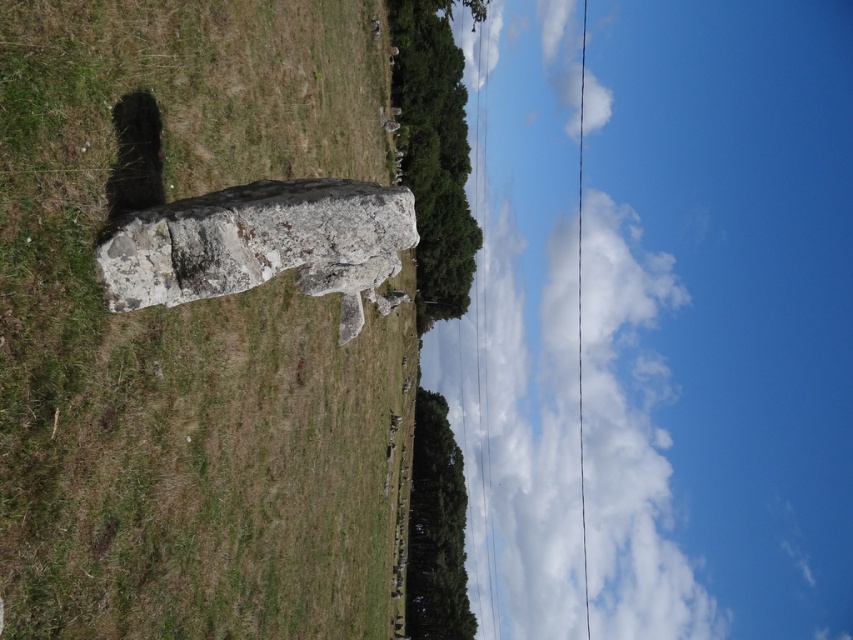
Is white fluffy cloud at upper center thinner than rough stone rock at center?

Incorrect, white fluffy cloud at upper center's width is not less than rough stone rock at center's.

Between point (624, 221) and point (223, 200), which one is positioned behind?

The point (624, 221) is more distant.

At what (x,y) coordinates should I click in order to perform the action: click on white fluffy cloud at upper center. Please return your answer as a coordinate pair (x, y). Looking at the image, I should click on (560, 388).

Does speckled stone monolith at center lie in front of rough stone rock at center?

Yes, speckled stone monolith at center is closer to the viewer.

Is point (302, 83) farther from viewer compared to point (350, 317)?

That is False.

Find the location of a particular element. speckled stone monolith at center is located at coordinates (186, 332).

Find the location of `speckled stone monolith at center`. speckled stone monolith at center is located at coordinates (186, 332).

Does speckled stone monolith at center come behind white fluffy cloud at upper center?

No, speckled stone monolith at center is in front of white fluffy cloud at upper center.

Measure the distance between speckled stone monolith at center and camera.

9.23 meters

At what (x,y) coordinates should I click in order to perform the action: click on speckled stone monolith at center. Please return your answer as a coordinate pair (x, y). The image size is (853, 640). Looking at the image, I should click on (186, 332).

Locate an element on the screen. speckled stone monolith at center is located at coordinates (186, 332).